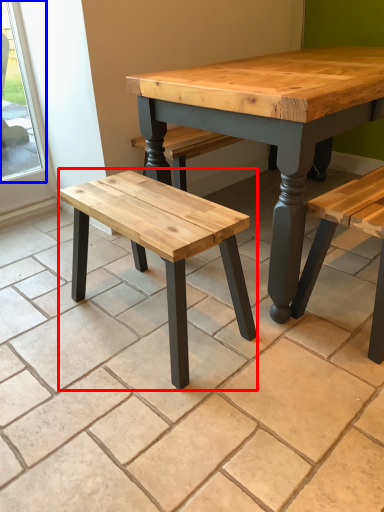
Question: Among these objects, which one is nearest to the camera, stool (highlighted by a red box) or window (highlighted by a blue box)?

Choices:
 (A) stool
 (B) window

Answer: (A)